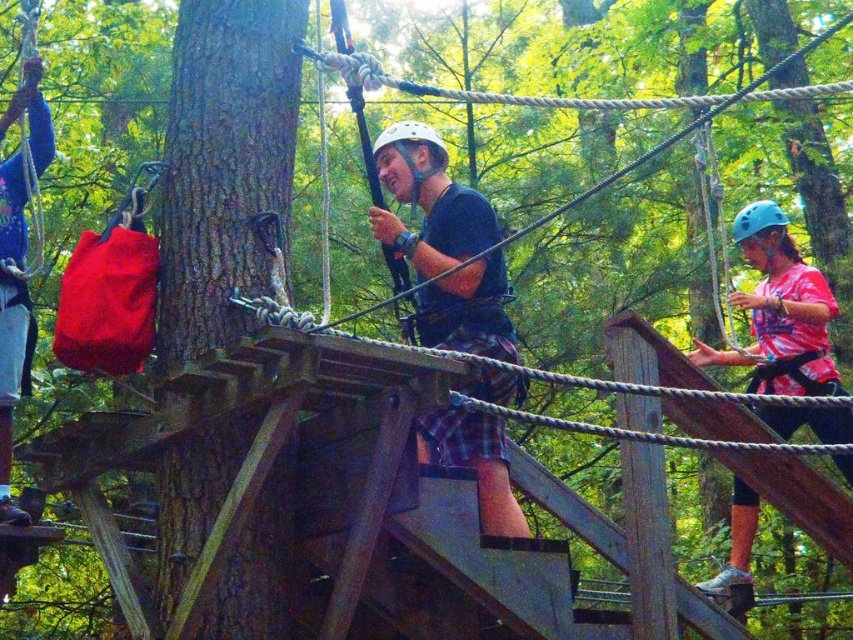
You are a participant in the ropes course and need to locate the white matte helmet at center and the smooth bark tree at left. From your perspective on the wooden platform, which object is positioned to the left?

The smooth bark tree at left is positioned to the left of the white matte helmet at center.

In the scene shown: You are standing on the wooden platform and want to locate the smooth bark tree at left. According to the coordinates provided, where would you look to find it?

The smooth bark tree at left is located at the coordinates point (223, 163).